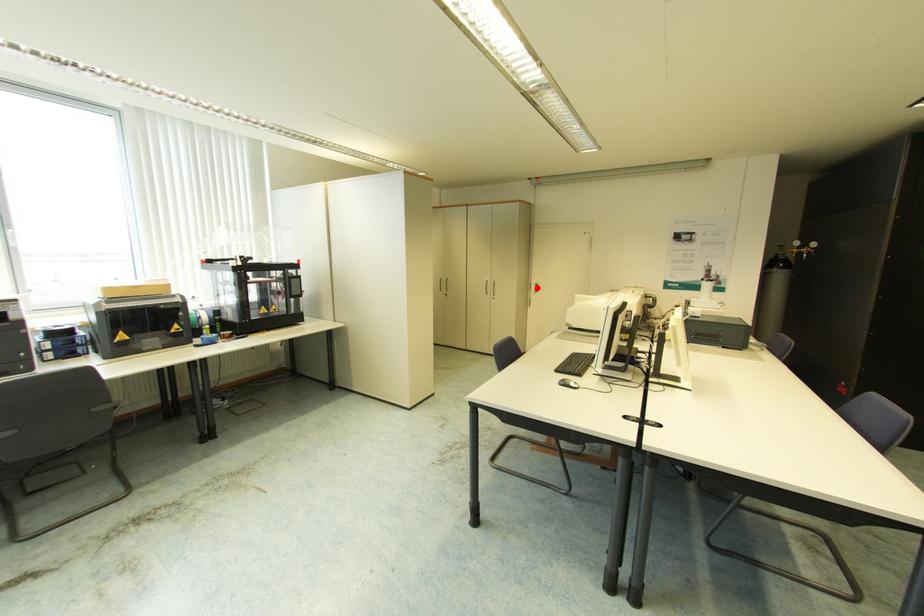
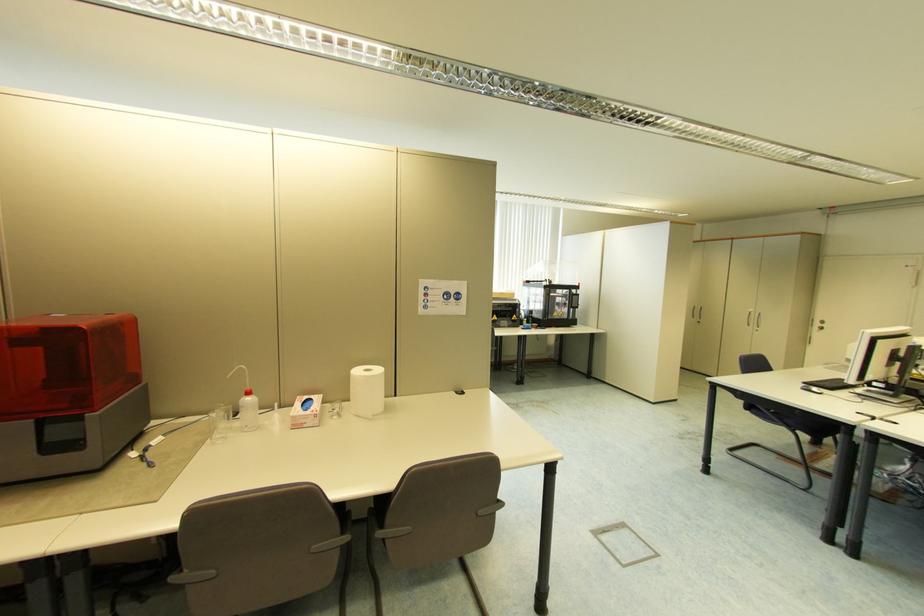
Find the pixel in the second image that matches the highlighted location in the first image.

(821, 325)